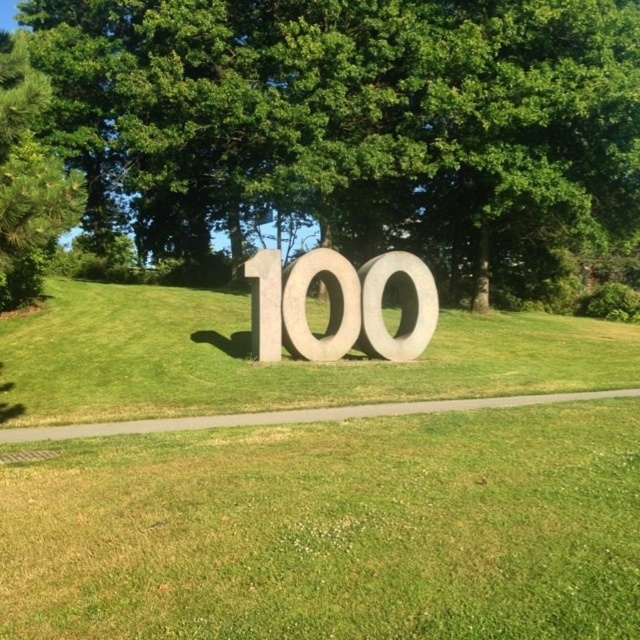
You are standing at the center of the sculpture and want to walk to the green pine at left. Which direction should you face to walk straight towards it?

You should face the left direction to walk straight towards the green pine at left since it is located at point (28, 179) relative to your position.